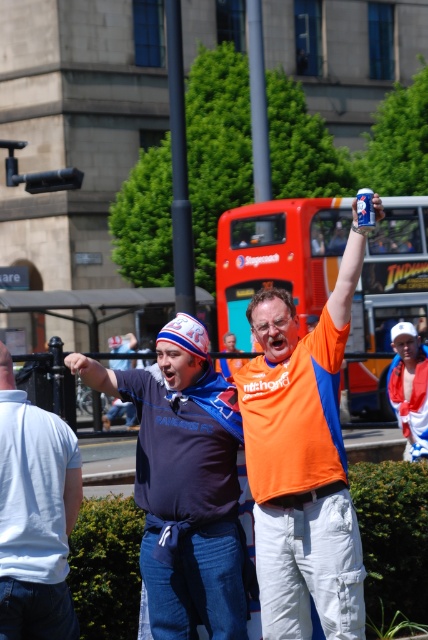
Question: Is red double-decker bus at center smaller than blue cotton shirt at center?

Choices:
 (A) no
 (B) yes

Answer: (B)

Question: Is dark blue jersey at center to the left of blue cotton shirt at center from the viewer's perspective?

Choices:
 (A) yes
 (B) no

Answer: (B)

Question: Considering the relative positions of red double-decker bus at center and blue cotton shirt at center in the image provided, where is red double-decker bus at center located with respect to blue cotton shirt at center?

Choices:
 (A) above
 (B) below

Answer: (B)

Question: Which point is farther to the camera?

Choices:
 (A) white cotton cap at upper right
 (B) dark blue jersey at center
 (C) blue cotton shirt at center
 (D) red double-decker bus at center

Answer: (D)

Question: Which point is farther to the camera?

Choices:
 (A) (329, 228)
 (B) (56, 598)
 (C) (424, 387)

Answer: (A)

Question: Estimate the real-world distances between objects in this image. Which object is closer to the orange fabric shirt at center?

Choices:
 (A) red double-decker bus at center
 (B) blue cotton shirt at center

Answer: (B)